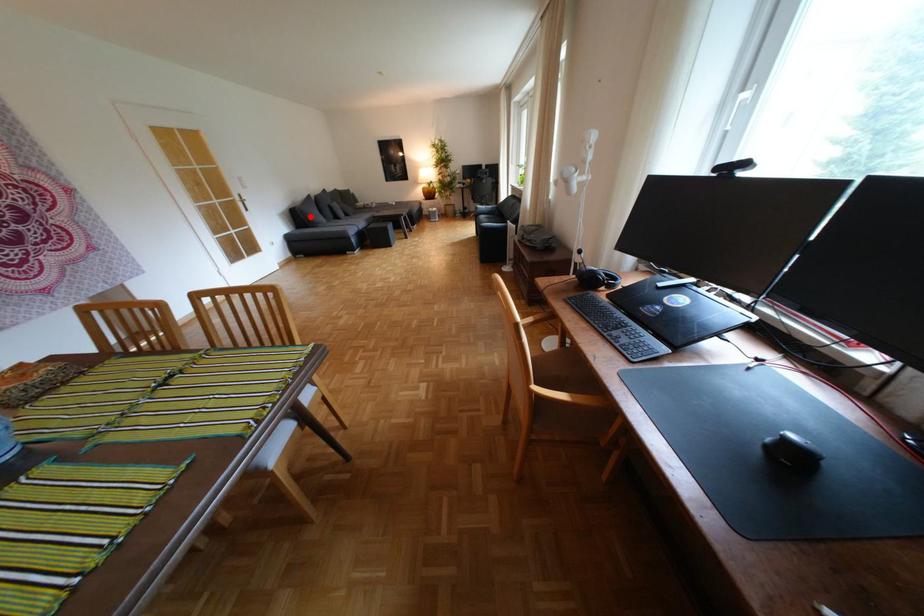
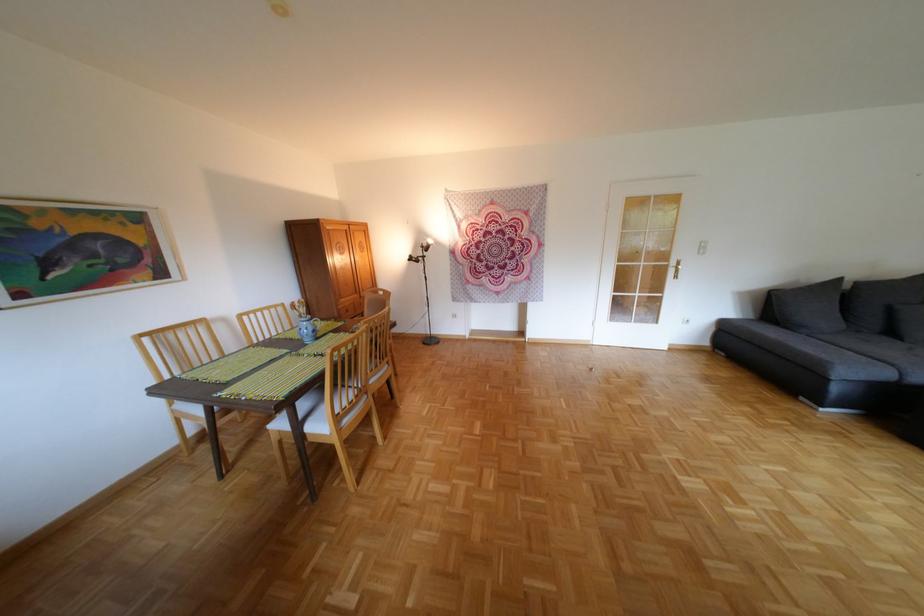
Find the pixel in the second image that matches the highlighted location in the first image.

(787, 304)